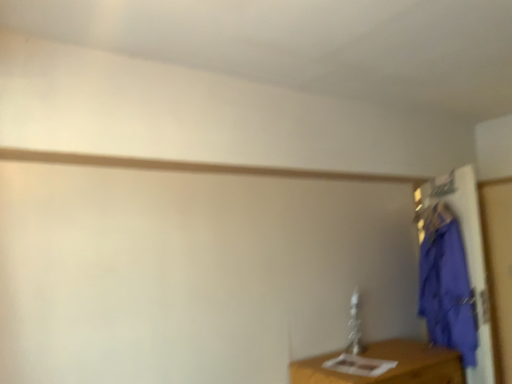
What is the approximate height of purple fabric coat at right?

It is 83.18 centimeters.

The image size is (512, 384). What do you see at coordinates (447, 285) in the screenshot?
I see `purple fabric coat at right` at bounding box center [447, 285].

What is the approximate width of purple fabric coat at right?

purple fabric coat at right is 4.82 inches in width.

This screenshot has width=512, height=384. I want to click on purple fabric coat at right, so click(447, 285).

I want to click on purple fabric coat at right, so click(447, 285).